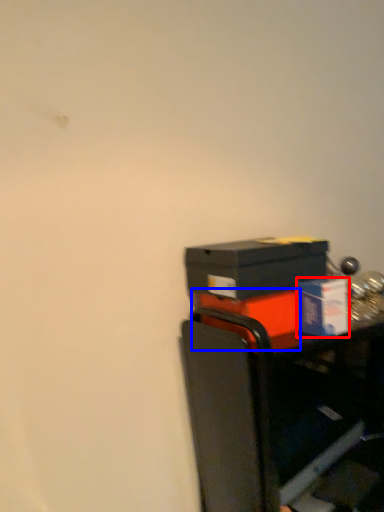
Question: Which object is further to the camera taking this photo, box (highlighted by a red box) or box (highlighted by a blue box)?

Choices:
 (A) box
 (B) box

Answer: (B)